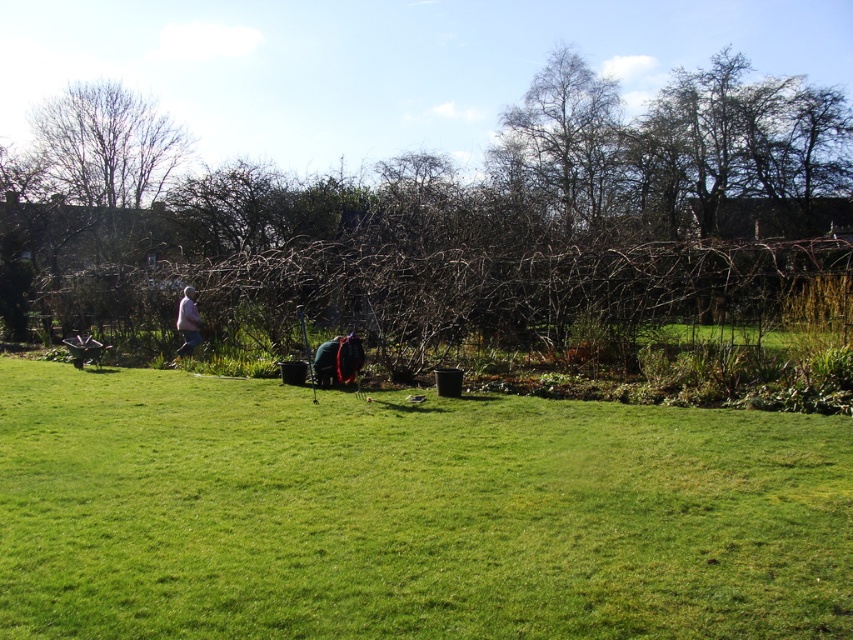
In the scene shown: You are planning to place a small garden ornament on the green grassy area at center. Considering the size of the green grassy at center compared to the bare branches at upper center, will there be enough space for the ornament?

The green grassy at center is smaller than the bare branches at upper center, so there might not be enough space for the ornament if the ornament requires more space than the grassy area can accommodate.

You are standing at the point with coordinates point (489,154) and want to walk towards the point with coordinates point (573,552). Based on the scene description, will you pass through the area where the person is walking?

Yes, you will pass through the area where the person is walking because point (573,552) is in front of point (489,154), meaning the path between them would cross the person walking in the midground.